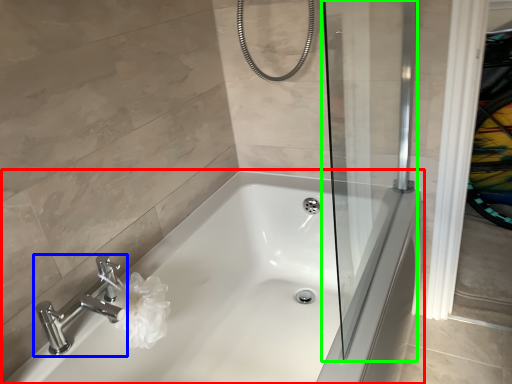
Question: Which object is positioned closest to bathtub (highlighted by a red box)? Select from tap (highlighted by a blue box) and screen door (highlighted by a green box).

Choices:
 (A) tap
 (B) screen door

Answer: (B)